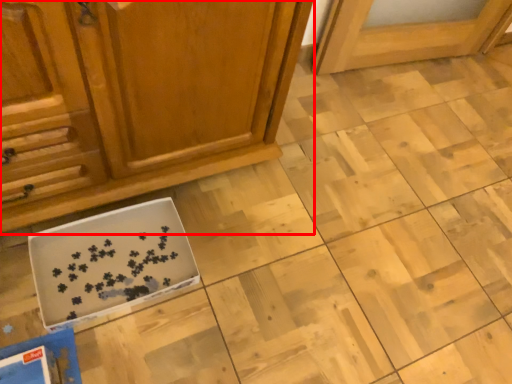
Question: From the image's perspective, considering the relative positions of cabinetry (annotated by the red box) and cardboard box in the image provided, where is cabinetry (annotated by the red box) located with respect to the staircase?

Choices:
 (A) below
 (B) above

Answer: (B)